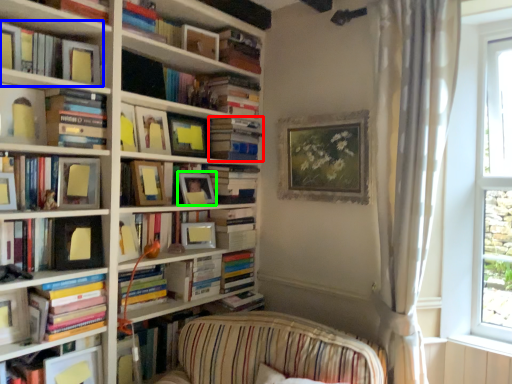
Question: Considering the real-world distances, which object is closest to book (highlighted by a red box)? book (highlighted by a blue box) or picture frame (highlighted by a green box).

Choices:
 (A) book
 (B) picture frame

Answer: (B)